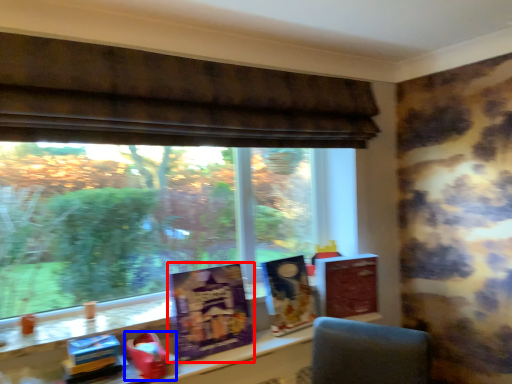
Question: Among these objects, which one is farthest to the camera, paperback book (highlighted by a red box) or toy (highlighted by a blue box)?

Choices:
 (A) paperback book
 (B) toy

Answer: (A)